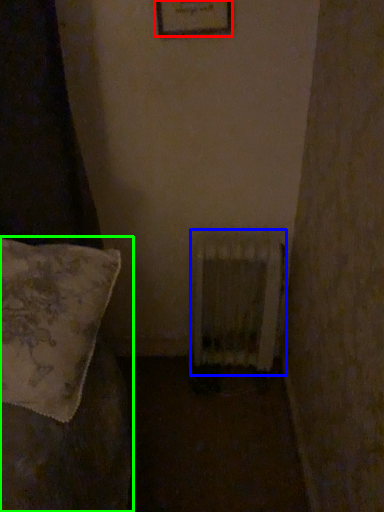
Question: Which object is the closest to the picture frame (highlighted by a red box)? Choose among these: radiator (highlighted by a blue box) or furniture (highlighted by a green box).

Choices:
 (A) radiator
 (B) furniture

Answer: (A)